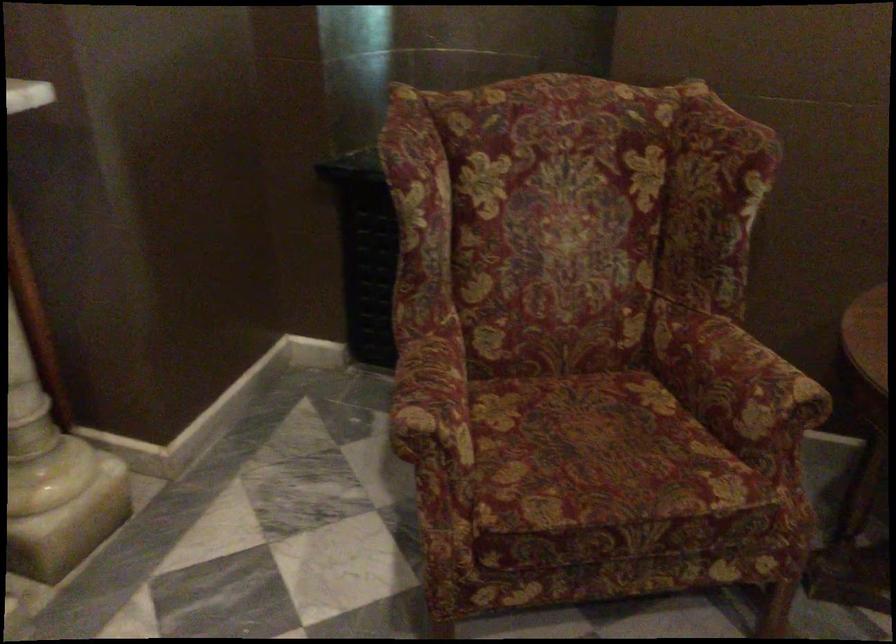
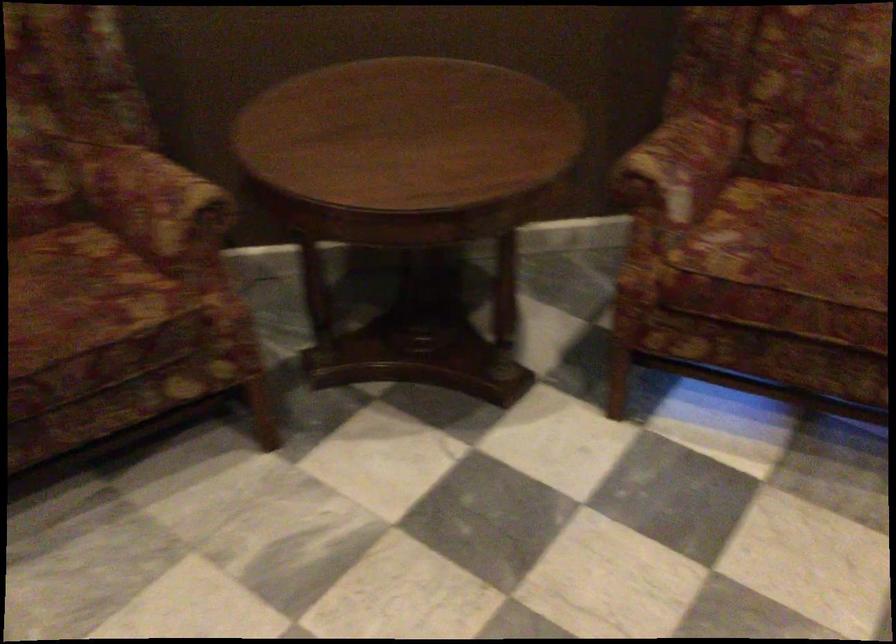
The point at (651, 449) is marked in the first image. Where is the corresponding point in the second image?

(80, 292)